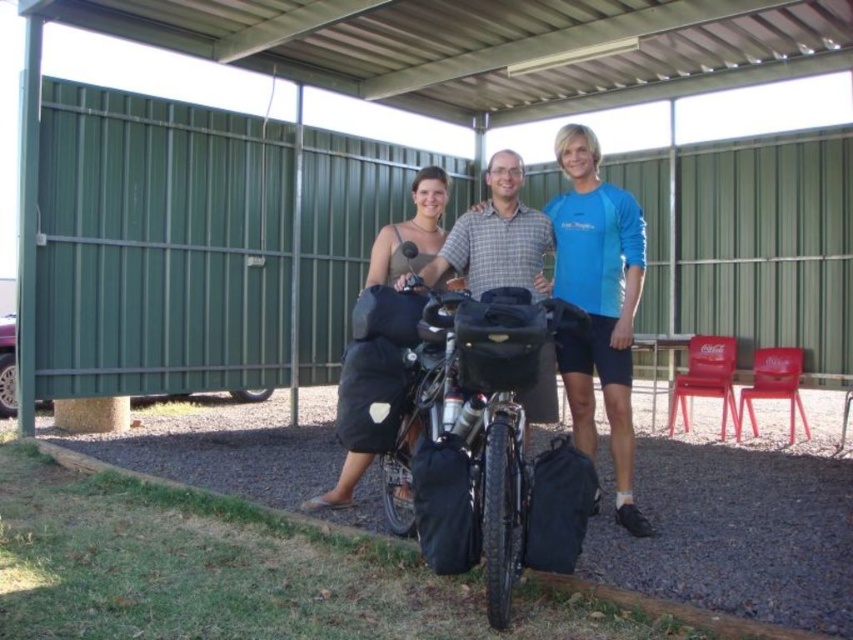
Who is higher up, matte black bicycle at center or matte black tank top at center?

matte black tank top at center

Looking at this image, who is positioned more to the left, matte black bicycle at center or matte black tank top at center?

matte black tank top at center is more to the left.

Which is behind, point (590, 160) or point (349, 458)?

The point (349, 458) is more distant.

The width and height of the screenshot is (853, 640). What are the coordinates of `matte black bicycle at center` in the screenshot? It's located at coord(567,282).

Which of these two, black matte bicycle at center or matte black tank top at center, stands shorter?

Standing shorter between the two is matte black tank top at center.

Is black matte bicycle at center thinner than matte black tank top at center?

Correct, black matte bicycle at center's width is less than matte black tank top at center's.

Is point (381, 481) positioned after point (421, 227)?

No, it is in front of (421, 227).

At what (x,y) coordinates should I click in order to perform the action: click on black matte bicycle at center. Please return your answer as a coordinate pair (x, y). The image size is (853, 640). Looking at the image, I should click on (421, 404).

Does matte plaid shirt at center appear under black matte bicycle at center?

Incorrect, matte plaid shirt at center is not positioned below black matte bicycle at center.

Does matte plaid shirt at center come in front of black matte bicycle at center?

No, it is behind black matte bicycle at center.

Where is `matte plaid shirt at center`? This screenshot has width=853, height=640. matte plaid shirt at center is located at coordinates (497, 237).